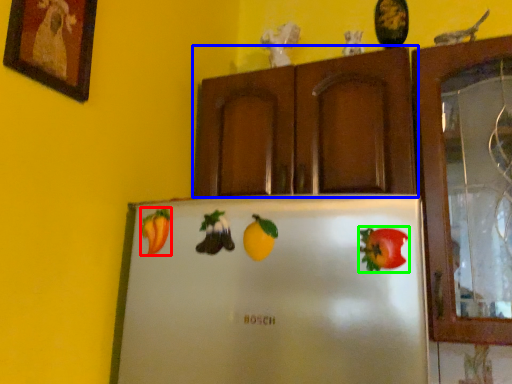
Question: Which object is the farthest from fruit (highlighted by a red box)? Choose among these: cabinetry (highlighted by a blue box) or fruit (highlighted by a green box).

Choices:
 (A) cabinetry
 (B) fruit

Answer: (A)